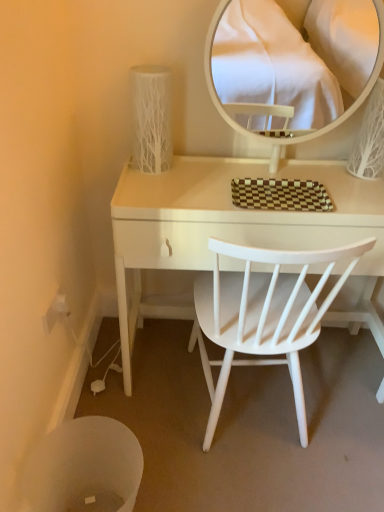
Identify the location of vacant region to the left of white glossy mirror at upper center. (197, 180).